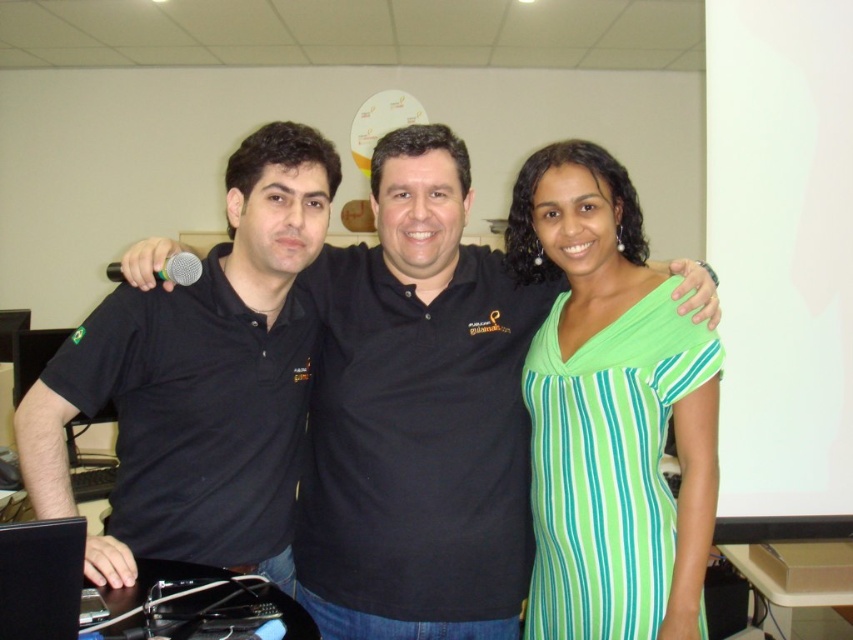
You are organizing a photo shoot and need to arrange the subjects so that the black cotton polo shirt at center is visible above the black matte shirt at left. Is this possible based on their current positions?

The black cotton polo shirt at center is positioned under the black matte shirt at left, so it cannot be visible above it in their current positions.

You are organizing a photo shoot and need to position a new object between the black cotton polo shirt at center and the black glossy laptop at lower left. Based on their current positions, where should you place the new object to ensure it is between them?

The black cotton polo shirt at center is to the right of the black glossy laptop at lower left, so you should place the new object between them to the right of the black glossy laptop at lower left and to the left of the black cotton polo shirt at center.